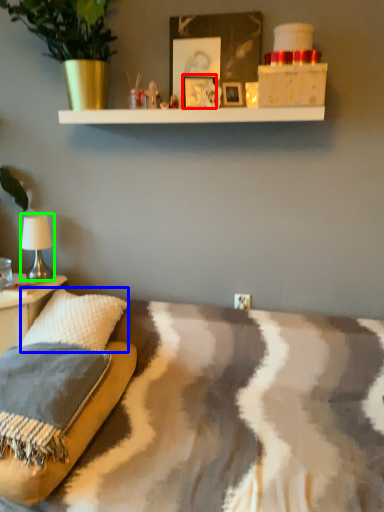
Question: Considering the real-world distances, which object is farthest from picture frame (highlighted by a red box)? throw pillow (highlighted by a blue box) or table lamp (highlighted by a green box)?

Choices:
 (A) throw pillow
 (B) table lamp

Answer: (A)